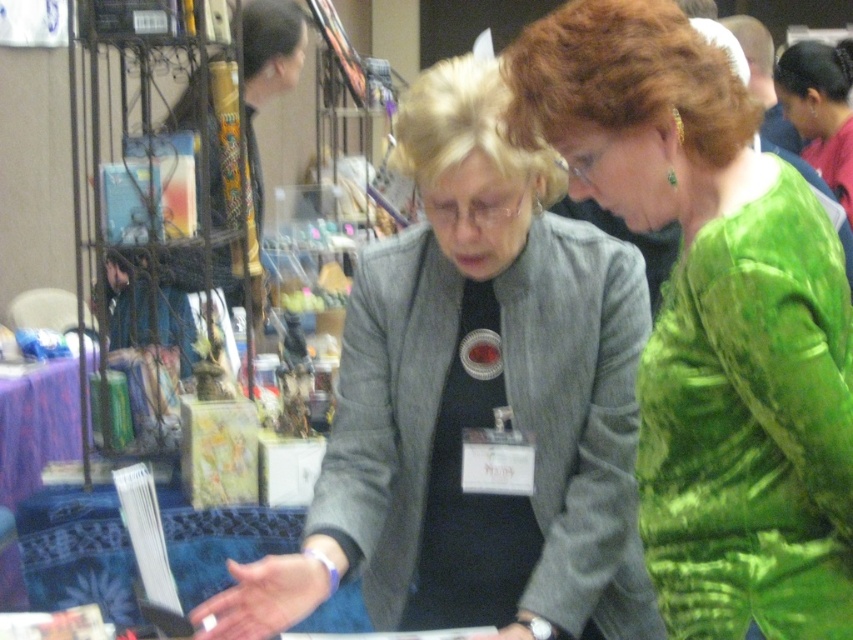
You are a tailor who needs to determine which garment is shorter between the matte gray blazer at center and the green shiny dress at upper right. Based on the scene, which one should you choose?

The matte gray blazer at center is not as tall as the green shiny dress at upper right, so the matte gray blazer at center is shorter and should be chosen.

You are a photographer at a fashion event and need to capture a clear shot of both the green textured dress at center and the green shiny dress at upper right. Which dress should you focus on first to ensure both are in focus?

You should focus on the green textured dress at center first because it is closer to the viewer. By focusing on the closer object, you can ensure that both the green textured dress at center and the green shiny dress at upper right will be in focus using depth of field.

You are a photographer at the event and want to capture a photo of both the matte gray blazer at center and the green shiny dress at upper right in the same frame. Based on their positions, which one should you focus on first to ensure both are in the frame?

The matte gray blazer at center is to the left of the green shiny dress at upper right, so you should focus on the matte gray blazer at center first to ensure both are in the frame.